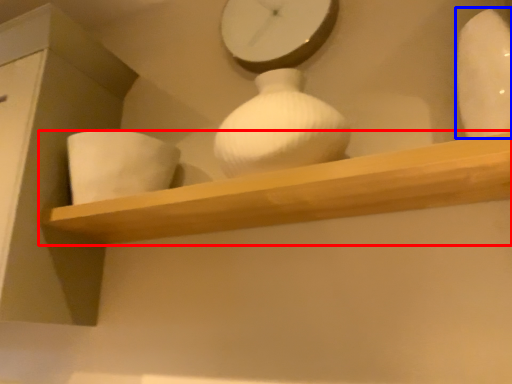
Question: Which object appears farthest to the camera in this image, shelf (highlighted by a red box) or vase (highlighted by a blue box)?

Choices:
 (A) shelf
 (B) vase

Answer: (A)